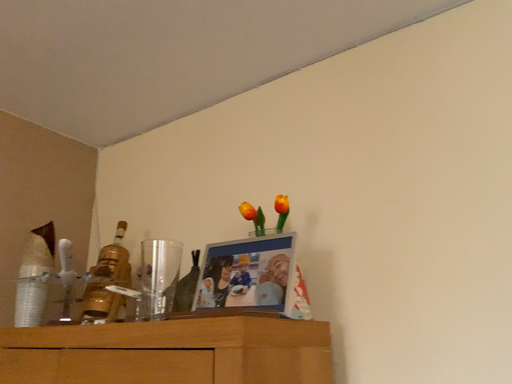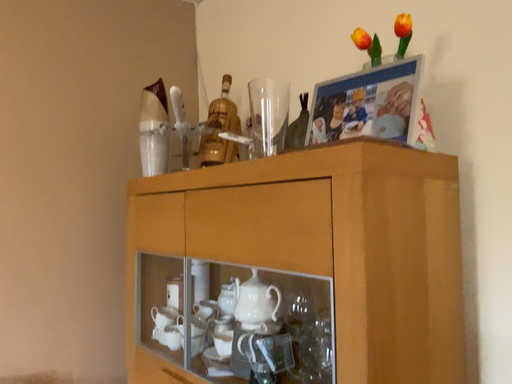
Question: How did the camera likely rotate when shooting the video?

Choices:
 (A) rotated right
 (B) rotated left

Answer: (B)